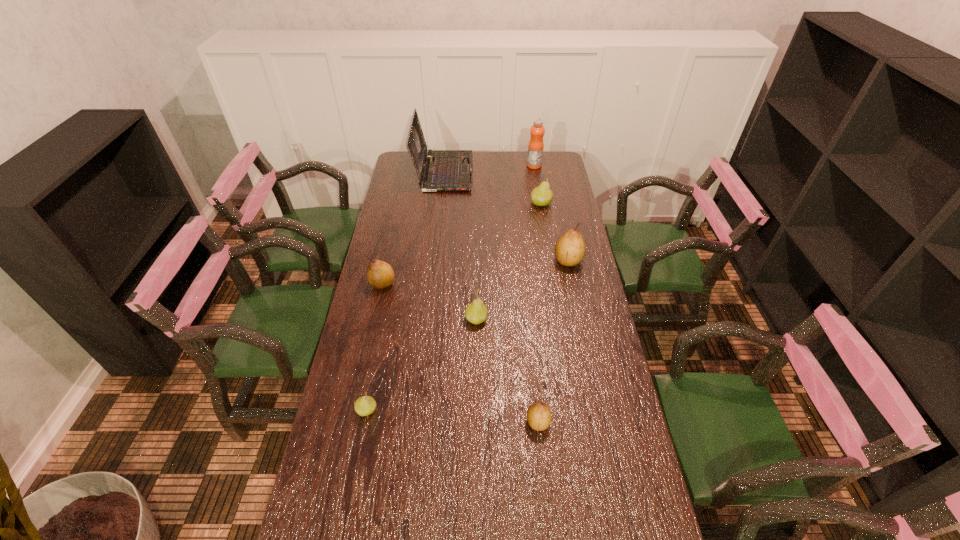
Where is `laptop computer`? laptop computer is located at coordinates (446, 170).

Identify the location of fruit juice. 536,145.

Image resolution: width=960 pixels, height=540 pixels. In order to click on the rightmost green pear in this screenshot , I will do `click(542, 195)`.

Identify the location of the biggest green pear. (542, 195).

Locate an element on the screen. the rightmost brown pear is located at coordinates (570, 249).

Locate an element on the screen. This screenshot has width=960, height=540. the biggest brown pear is located at coordinates (570, 249).

This screenshot has width=960, height=540. Find the location of `the fourth nearest pear`. the fourth nearest pear is located at coordinates (380, 275).

Identify the location of the leftmost brown pear. (380, 275).

You are a GUI agent. You are given a task and a screenshot of the screen. Output one action in this format:
    pyautogui.click(x=<x>, y=<y>)
    Task: Click on the second smallest green pear
    
    Given the screenshot: What is the action you would take?
    pyautogui.click(x=476, y=312)

Identify the location of the second farthest green pear. (476, 312).